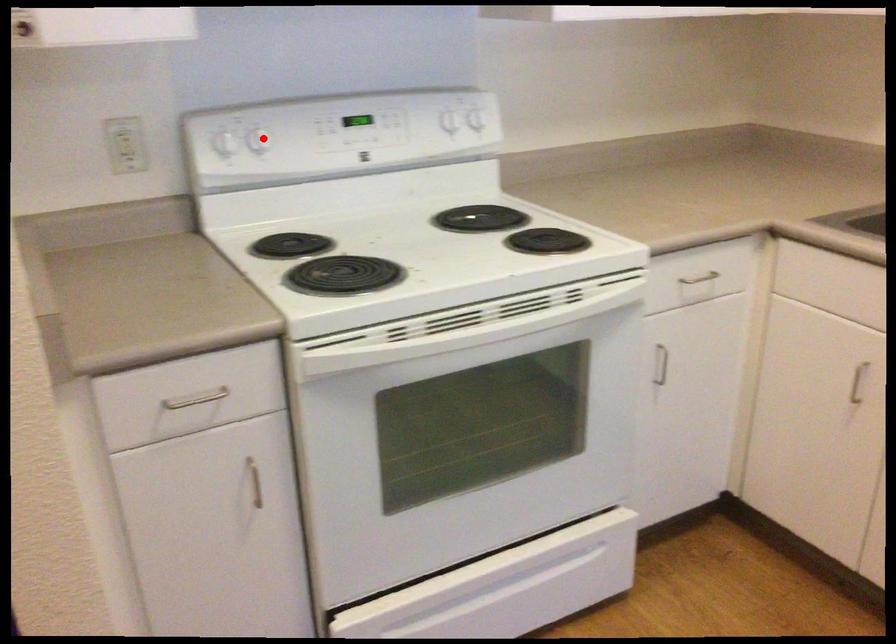
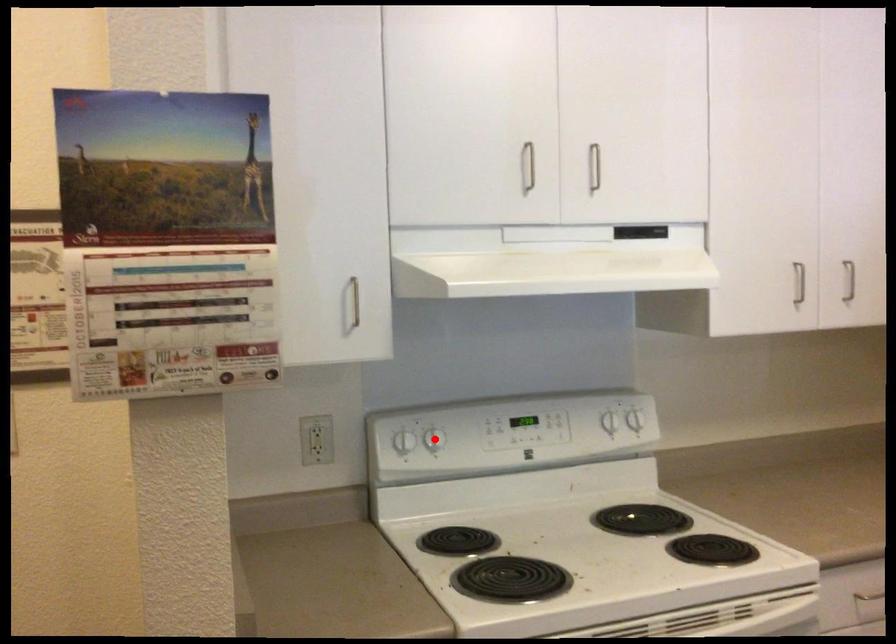
I am providing you with two images of the same scene from different viewpoints. A red point is marked on the first image and another point is marked on the second image. Do the highlighted points in image1 and image2 indicate the same real-world spot?

Yes